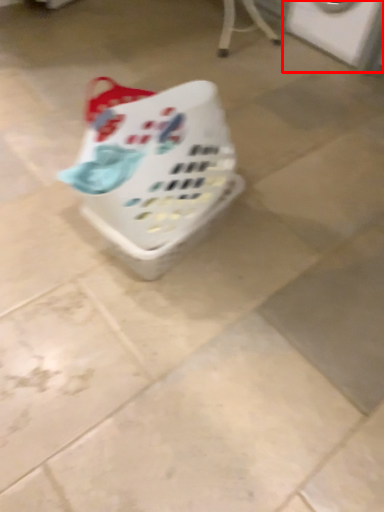
Question: From the image's perspective, where is washing machine (annotated by the red box) located relative to basket?

Choices:
 (A) above
 (B) below

Answer: (A)